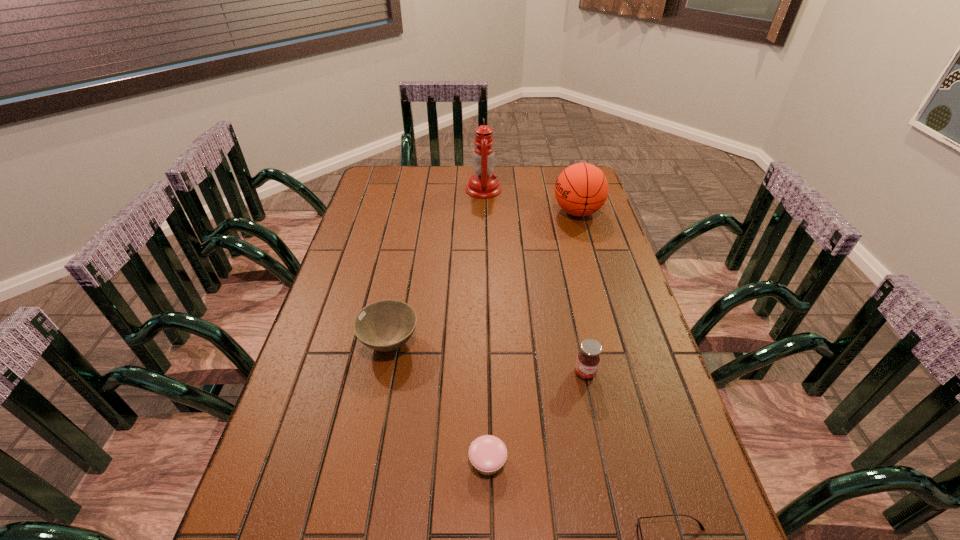
At what (x,y) coordinates should I click in order to perform the action: click on oil lamp. Please return your answer as a coordinate pair (x, y). The width and height of the screenshot is (960, 540). Looking at the image, I should click on (483, 185).

You are a GUI agent. You are given a task and a screenshot of the screen. Output one action in this format:
    pyautogui.click(x=<x>, y=<y>)
    Task: Click on the fifth shortest object
    The height and width of the screenshot is (540, 960).
    Given the screenshot: What is the action you would take?
    pyautogui.click(x=581, y=189)

Locate an element on the screen. The image size is (960, 540). the fourth shortest object is located at coordinates (x=588, y=359).

Locate an element on the screen. This screenshot has height=540, width=960. bowl is located at coordinates (386, 325).

In order to click on the leftmost object in this screenshot , I will do `click(386, 325)`.

At what (x,y) coordinates should I click in order to perform the action: click on the second shortest object. Please return your answer as a coordinate pair (x, y). Looking at the image, I should click on (487, 453).

You are a GUI agent. You are given a task and a screenshot of the screen. Output one action in this format:
    pyautogui.click(x=<x>, y=<y>)
    Task: Click on the cupcake
    The width and height of the screenshot is (960, 540).
    Given the screenshot: What is the action you would take?
    pyautogui.click(x=487, y=453)

This screenshot has width=960, height=540. Identify the location of vacant point located 0.060m on the right of the oil lamp. (516, 189).

Find the location of a particular element. free space located 0.150m on the side with logo of the fifth shortest object is located at coordinates (512, 212).

The width and height of the screenshot is (960, 540). I want to click on vacant space situated 0.150m on the side with logo of the fifth shortest object, so click(x=512, y=212).